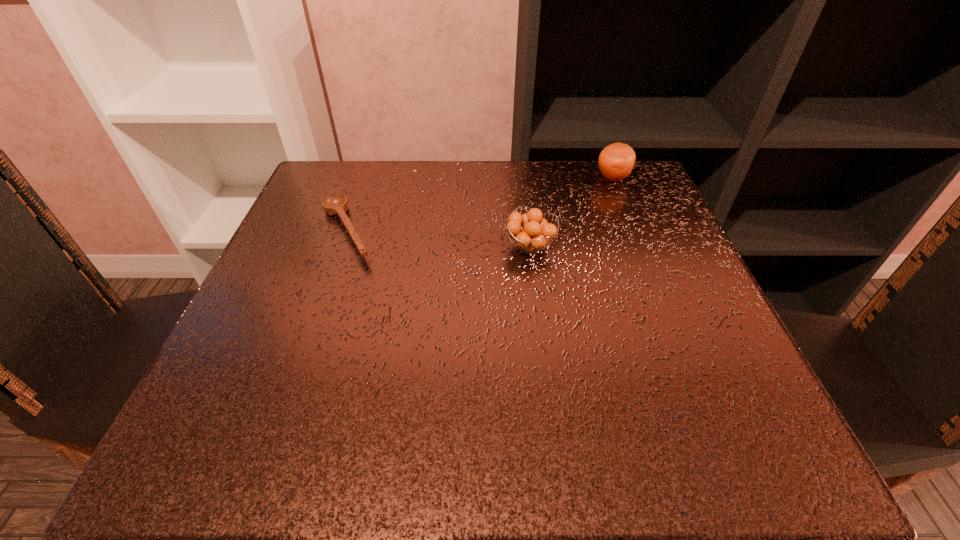
At what (x,y) coordinates should I click in order to perform the action: click on free space at the near left corner of the desktop. Please return your answer as a coordinate pair (x, y). Looking at the image, I should click on (312, 403).

I want to click on free region at the far right corner, so click(617, 203).

Locate an element on the screen. The height and width of the screenshot is (540, 960). empty space that is in between the leftmost object and the shorter orange fruit is located at coordinates (439, 239).

The image size is (960, 540). I want to click on free spot between the farthest object and the shortest object, so click(x=480, y=205).

Where is `vacant space that is in between the second tallest object and the leftmost object`? This screenshot has height=540, width=960. vacant space that is in between the second tallest object and the leftmost object is located at coordinates (439, 239).

At what (x,y) coordinates should I click in order to perform the action: click on blank region between the rightmost object and the shortest object. Please return your answer as a coordinate pair (x, y). This screenshot has height=540, width=960. Looking at the image, I should click on (480, 205).

Where is `vacant space in between the farther orange fruit and the left orange fruit`? The height and width of the screenshot is (540, 960). vacant space in between the farther orange fruit and the left orange fruit is located at coordinates (571, 212).

Identify the location of free spot between the farthest object and the leftmost object. This screenshot has height=540, width=960. (480, 205).

Find the location of a particular element. vacant space that is in between the wooden spoon and the second shortest object is located at coordinates (439, 239).

The image size is (960, 540). Identify the location of vacant space that's between the nearer orange fruit and the leftmost object. (439, 239).